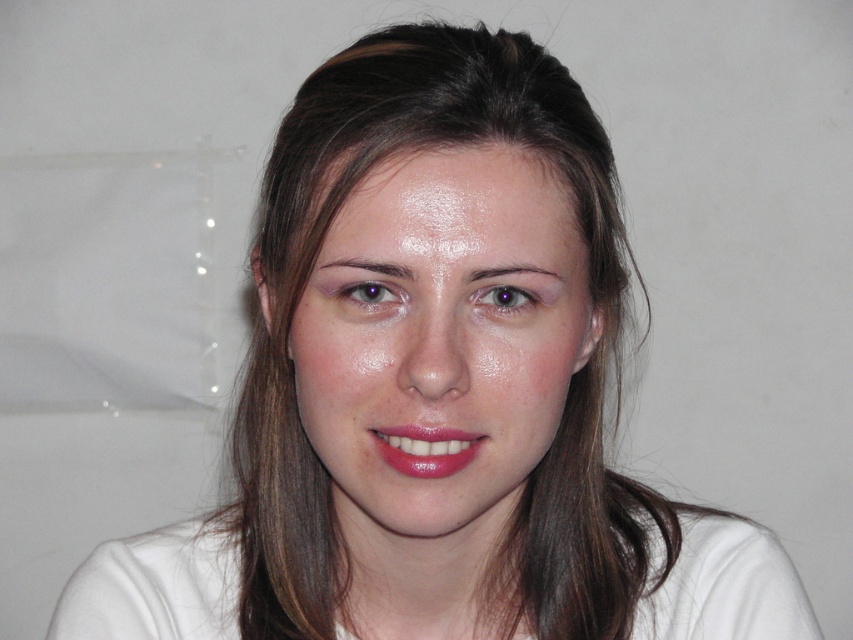
Can you confirm if smooth skin face at center is positioned to the left of purple glossy eye at center?

Correct, you'll find smooth skin face at center to the left of purple glossy eye at center.

Where is `smooth skin face at center`? The width and height of the screenshot is (853, 640). smooth skin face at center is located at coordinates (442, 342).

The width and height of the screenshot is (853, 640). Find the location of `smooth skin face at center`. smooth skin face at center is located at coordinates (442, 342).

Can you confirm if smooth skin face at center is wider than glossy matte lipstick at center?

Indeed, smooth skin face at center has a greater width compared to glossy matte lipstick at center.

Can you confirm if smooth skin face at center is thinner than glossy matte lipstick at center?

No.

At what (x,y) coordinates should I click in order to perform the action: click on smooth skin face at center. Please return your answer as a coordinate pair (x, y). The image size is (853, 640). Looking at the image, I should click on (442, 342).

Can you confirm if matte skin eye at center is positioned above purple glossy eye at center?

Correct, matte skin eye at center is located above purple glossy eye at center.

Image resolution: width=853 pixels, height=640 pixels. What do you see at coordinates (370, 296) in the screenshot?
I see `matte skin eye at center` at bounding box center [370, 296].

In order to click on matte skin eye at center in this screenshot , I will do (370, 296).